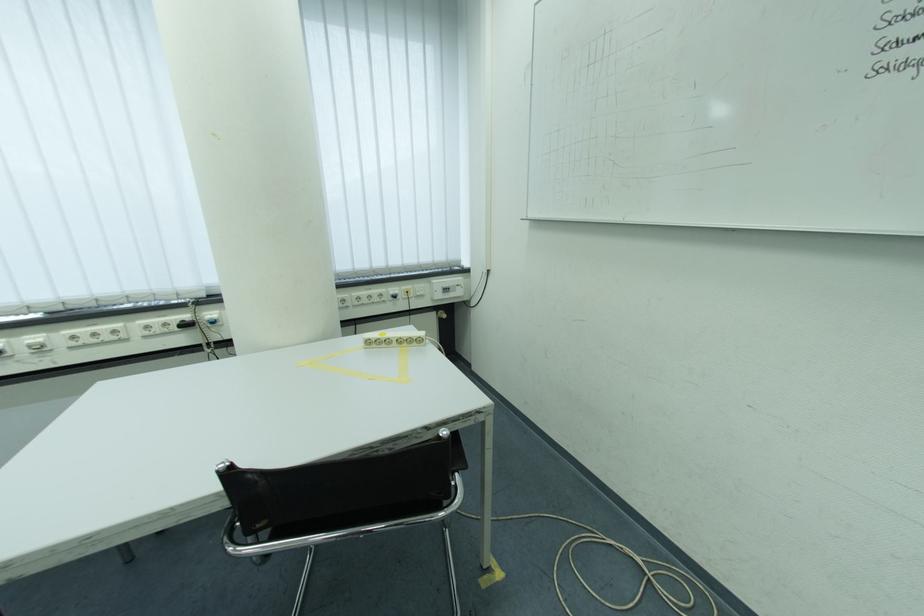
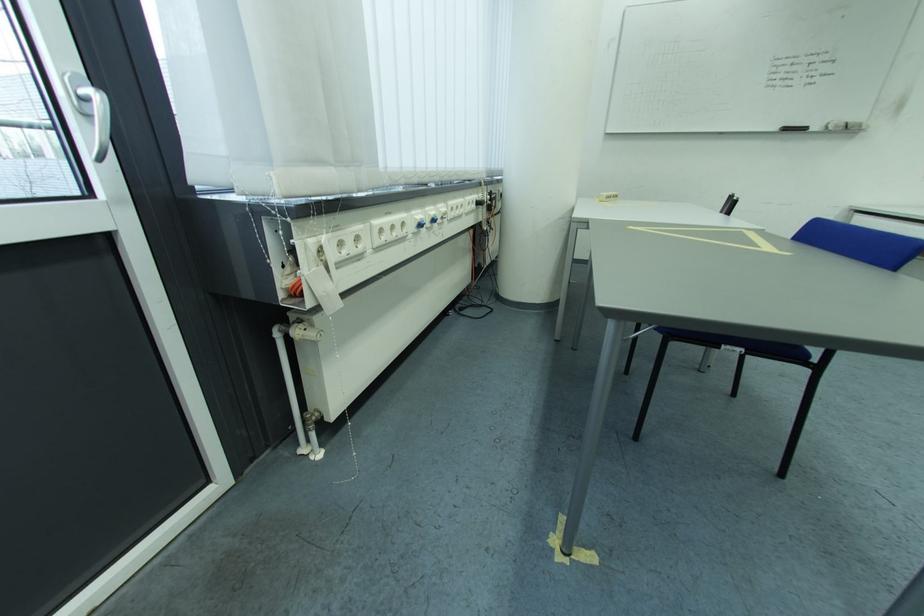
Question: I am providing you with two images of the same scene from different viewpoints. After the viewpoint changes to image2, which objects are now occluded?

Choices:
 (A) white power socket
 (B) black whiteboard marker
 (C) whiteboard eraser
 (D) none of these

Answer: (D)